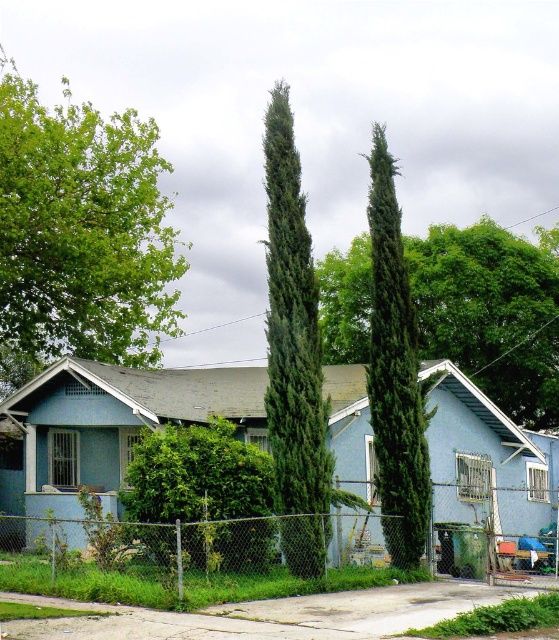
Question: Which object is closer to the camera taking this photo?

Choices:
 (A) green textured cypress at center
 (B) green textured cypress tree at center
 (C) green textured tree at center

Answer: (A)

Question: Can you confirm if green textured tree at center is positioned above green textured cypress at center?

Choices:
 (A) yes
 (B) no

Answer: (B)

Question: Is green textured tree at center closer to the viewer compared to green leafy bush at center?

Choices:
 (A) yes
 (B) no

Answer: (B)

Question: Which point appears closest to the camera in this image?

Choices:
 (A) (79, 292)
 (B) (530, 355)
 (C) (183, 490)
 (D) (191, 596)

Answer: (D)

Question: Among these objects, which one is farthest from the camera?

Choices:
 (A) green leafy bush at center
 (B) green textured cypress tree at center
 (C) chain-link fence at center

Answer: (B)

Question: Where is chain-link fence at center located in relation to green leafy bush at center in the image?

Choices:
 (A) below
 (B) above

Answer: (A)